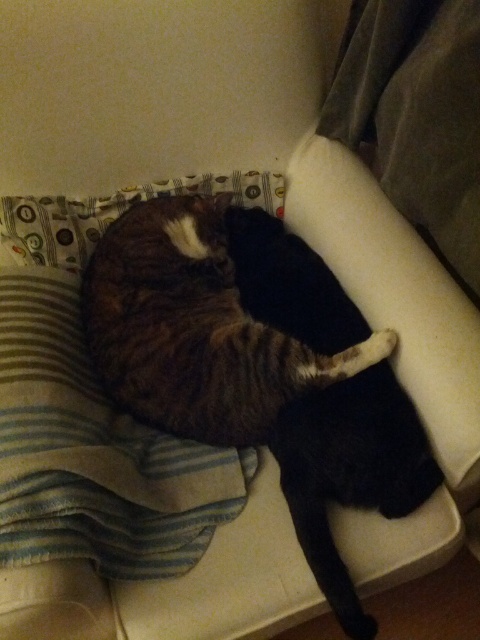
Question: Based on their relative distances, which object is nearer to the striped fleece blanket at lower left?

Choices:
 (A) tabby fur cat at center
 (B) striped fur cat at center

Answer: (A)

Question: Does tabby fur cat at center appear on the right side of striped fur cat at center?

Choices:
 (A) no
 (B) yes

Answer: (A)

Question: Is tabby fur cat at center to the left of striped fur cat at center from the viewer's perspective?

Choices:
 (A) yes
 (B) no

Answer: (A)

Question: Which point is closer to the camera?

Choices:
 (A) striped fleece blanket at lower left
 (B) striped fur cat at center
 (C) tabby fur cat at center

Answer: (A)

Question: Observing the image, what is the correct spatial positioning of tabby fur cat at center in reference to striped fur cat at center?

Choices:
 (A) right
 (B) left

Answer: (B)

Question: Among these objects, which one is farthest from the camera?

Choices:
 (A) tabby fur cat at center
 (B) striped fleece blanket at lower left
 (C) striped fur cat at center

Answer: (A)